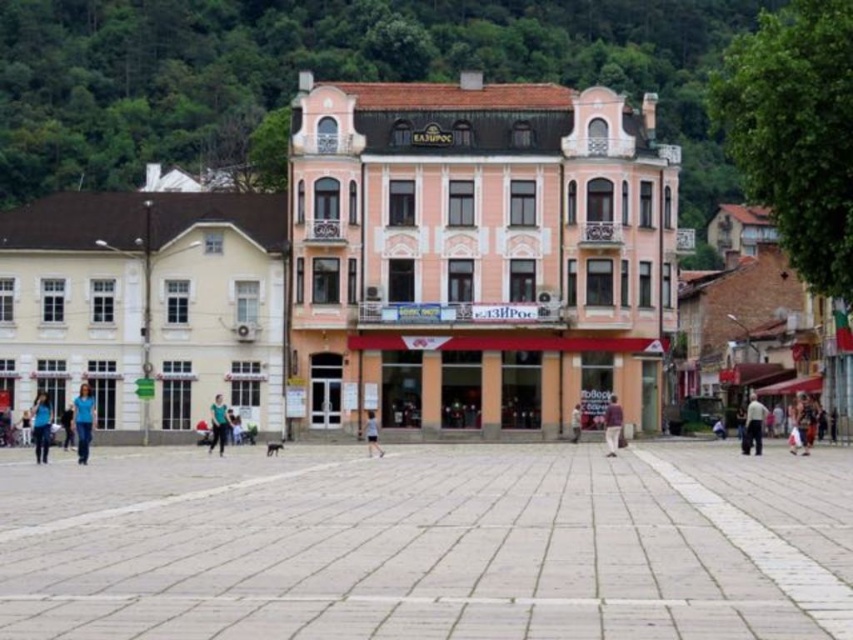
Question: Which of the following is the farthest from the observer?

Choices:
 (A) (592, 532)
 (B) (759, 435)
 (C) (33, 433)

Answer: (C)

Question: Considering the relative positions of gray stone pavement at center and pink matte building at center in the image provided, where is gray stone pavement at center located with respect to pink matte building at center?

Choices:
 (A) left
 (B) right

Answer: (A)

Question: Which of the following is the closest to the observer?

Choices:
 (A) gray stone pavement at center
 (B) pink matte building at center
 (C) blue fabric shirt at lower left
 (D) blue fabric shirt at center

Answer: (A)

Question: Does blue fabric shirt at lower left come in front of white cotton shirt at center?

Choices:
 (A) no
 (B) yes

Answer: (B)

Question: Does gray stone pavement at center lie in front of white cotton shirt at center?

Choices:
 (A) yes
 (B) no

Answer: (A)

Question: Which point is farther from the camera taking this photo?

Choices:
 (A) 85,438
 (B) 752,406

Answer: (B)